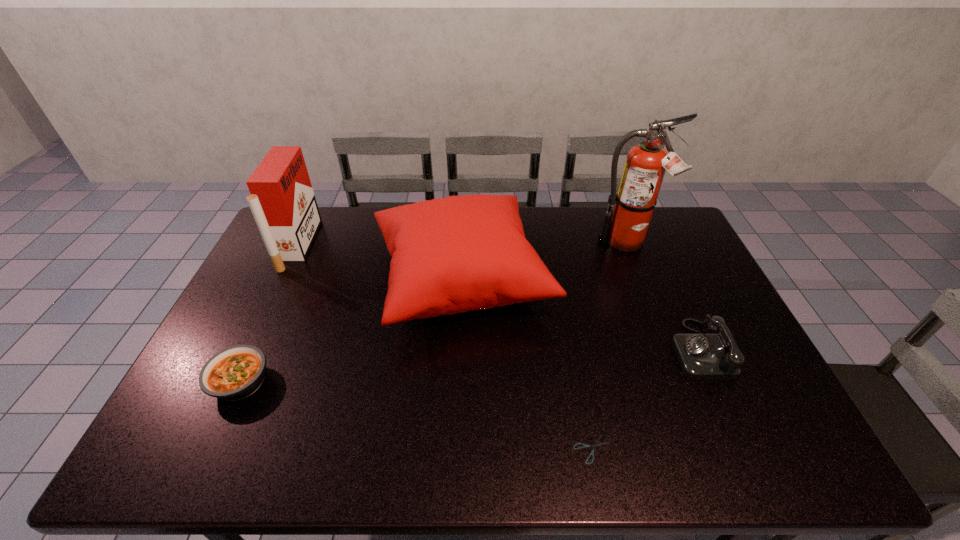
This screenshot has height=540, width=960. In order to click on free space that is in between the cushion and the third shortest object in this screenshot , I will do `click(580, 314)`.

Find the location of a particular element. vacant region between the cushion and the shears is located at coordinates (527, 363).

Where is `vacant point located between the shears and the fifth shortest object`? vacant point located between the shears and the fifth shortest object is located at coordinates (445, 347).

This screenshot has height=540, width=960. Find the location of `free area in between the cushion and the stew`. free area in between the cushion and the stew is located at coordinates coord(350,330).

This screenshot has width=960, height=540. In order to click on free spot between the fourth tallest object and the shears in this screenshot , I will do `click(645, 400)`.

Locate an element on the screen. The width and height of the screenshot is (960, 540). vacant area that lies between the fire extinguisher and the fourth shortest object is located at coordinates (543, 261).

Locate an element on the screen. This screenshot has height=540, width=960. free space that is in between the tallest object and the telephone is located at coordinates (662, 297).

Locate an element on the screen. Image resolution: width=960 pixels, height=540 pixels. vacant space that's between the third shortest object and the fifth tallest object is located at coordinates (469, 366).

You are a GUI agent. You are given a task and a screenshot of the screen. Output one action in this format:
    pyautogui.click(x=<x>, y=<y>)
    Task: Click on the fourth closest object to the third shortest object
    This screenshot has height=540, width=960.
    Given the screenshot: What is the action you would take?
    pyautogui.click(x=234, y=373)

The width and height of the screenshot is (960, 540). In order to click on object that ranks as the second closest to the fire extinguisher in this screenshot , I will do `click(702, 356)`.